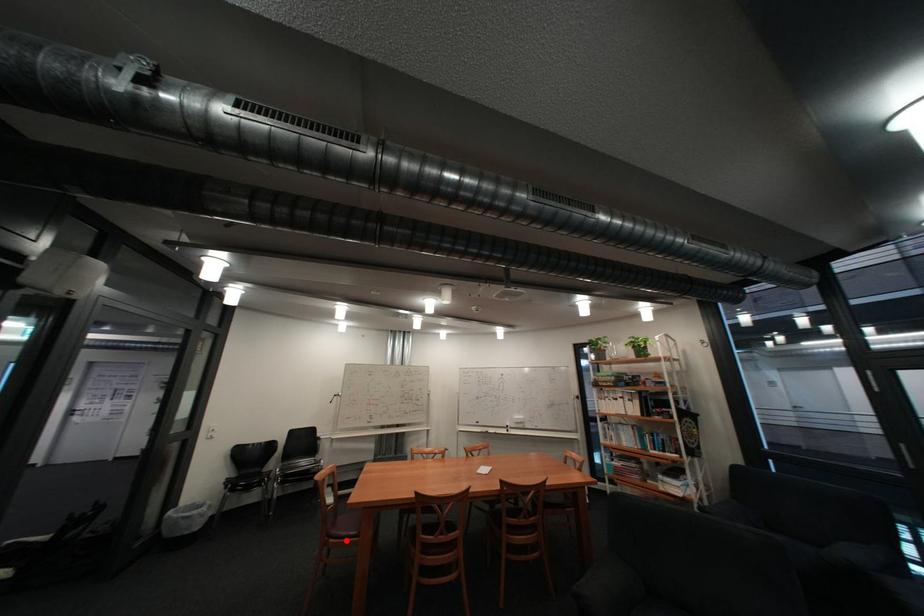
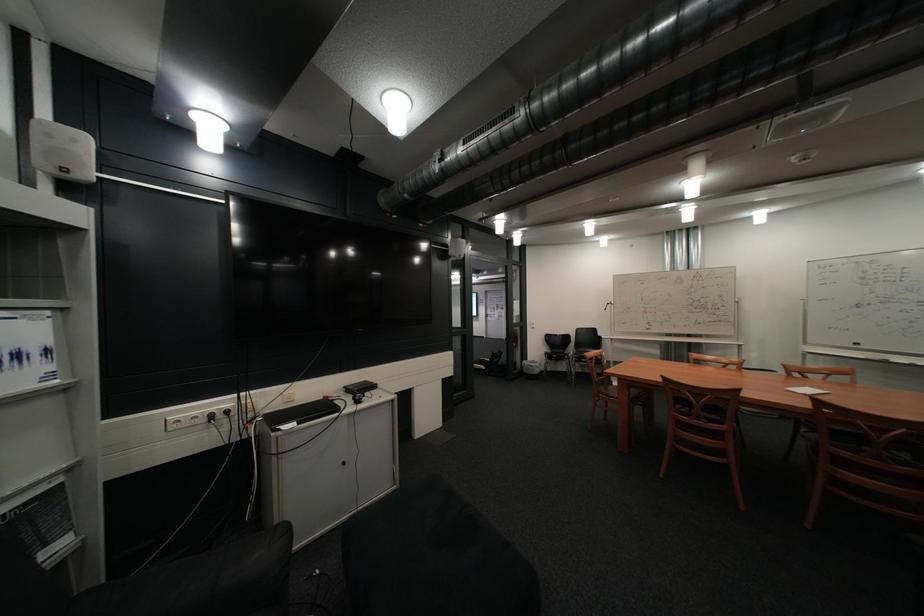
Question: I am providing you with two images of the same scene from different viewpoints. A red point is marked on the first image. Is the red point's position out of view in image 2?

Choices:
 (A) Yes
 (B) No

Answer: (B)